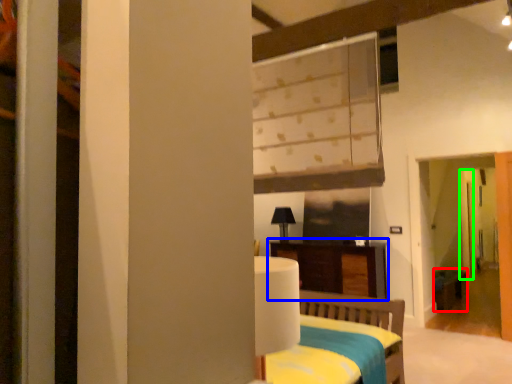
Question: Which object is the closest to the table (highlighted by a red box)? Choose among these: furniture (highlighted by a blue box) or door (highlighted by a green box).

Choices:
 (A) furniture
 (B) door

Answer: (B)